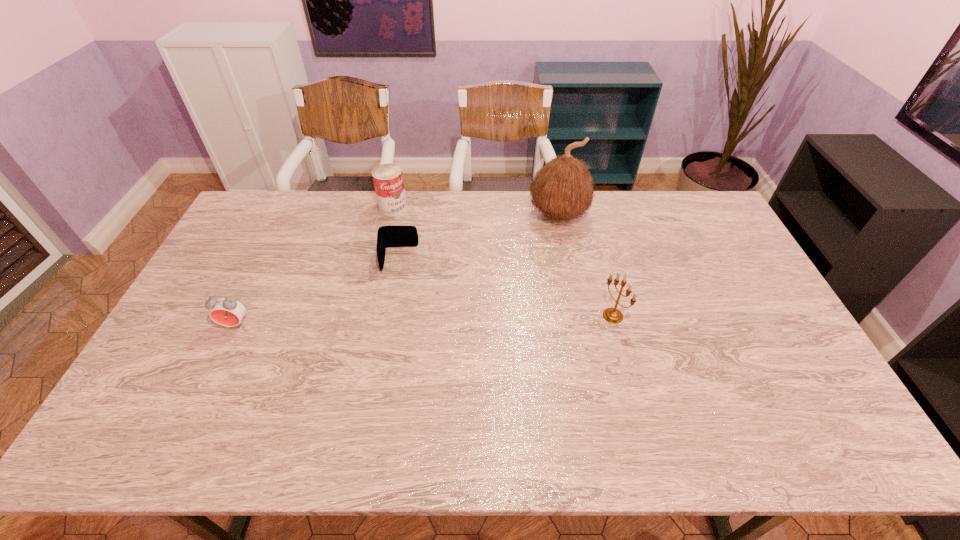
Identify the location of the leftmost object. (226, 311).

Image resolution: width=960 pixels, height=540 pixels. What are the coordinates of `the second shortest object` in the screenshot? It's located at (226, 311).

Where is `candelabrum`? candelabrum is located at coordinates (613, 315).

Find the location of `coconut`. coconut is located at coordinates (563, 189).

This screenshot has height=540, width=960. Identify the location of wallet. (387, 236).

The width and height of the screenshot is (960, 540). Identify the location of the shortest object. (387, 236).

Locate an element on the screen. can is located at coordinates (388, 181).

The image size is (960, 540). I want to click on vacant space situated on the face of the leftmost object, so click(x=208, y=380).

At what (x,y) coordinates should I click in order to perform the action: click on free location located on the left of the candelabrum. Please return your answer as a coordinate pair (x, y). The width and height of the screenshot is (960, 540). Looking at the image, I should click on (507, 316).

This screenshot has height=540, width=960. Identify the location of free region located on the surface of the tallest object. (534, 245).